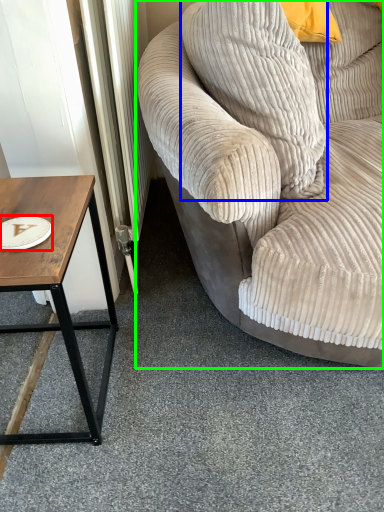
Question: Considering the real-world distances, which object is farthest from paper plate (highlighted by a red box)? pillow (highlighted by a blue box) or studio couch (highlighted by a green box)?

Choices:
 (A) pillow
 (B) studio couch

Answer: (B)